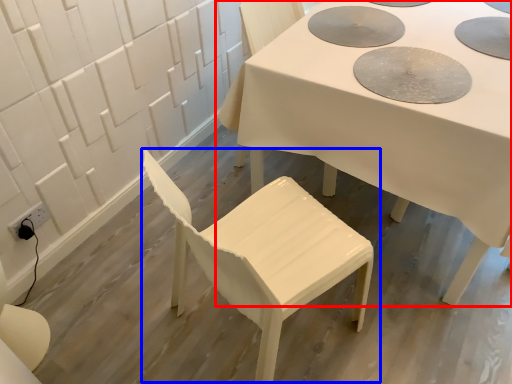
Question: Which object appears closest to the camera in this image, table (highlighted by a red box) or chair (highlighted by a blue box)?

Choices:
 (A) table
 (B) chair

Answer: (B)